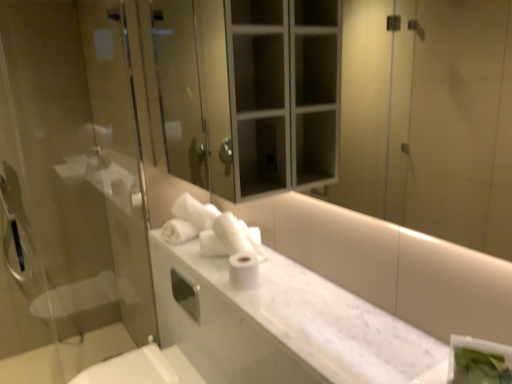
Locate an element on the screen. This screenshot has height=384, width=512. free spot above white marble counter top at center (from a real-world perspective) is located at coordinates (271, 290).